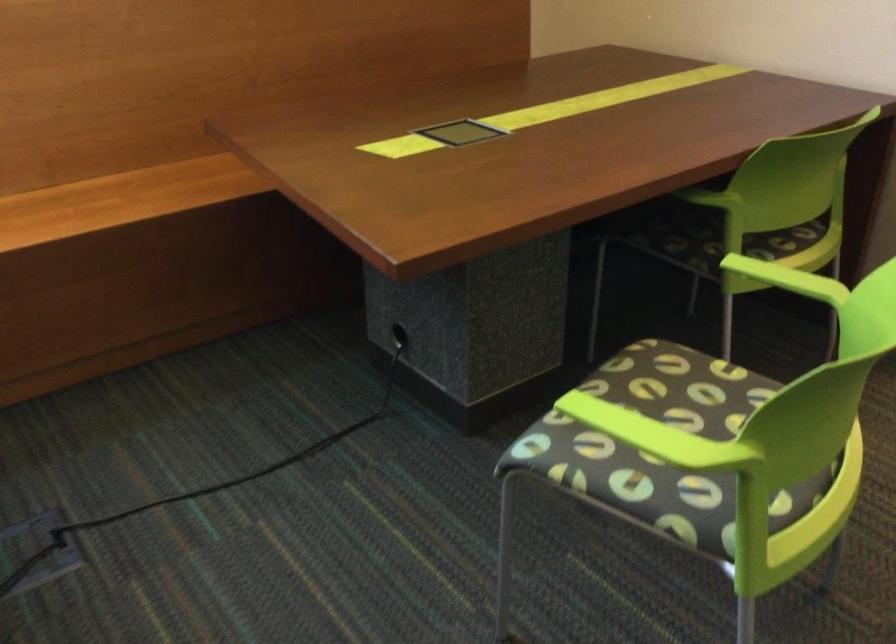
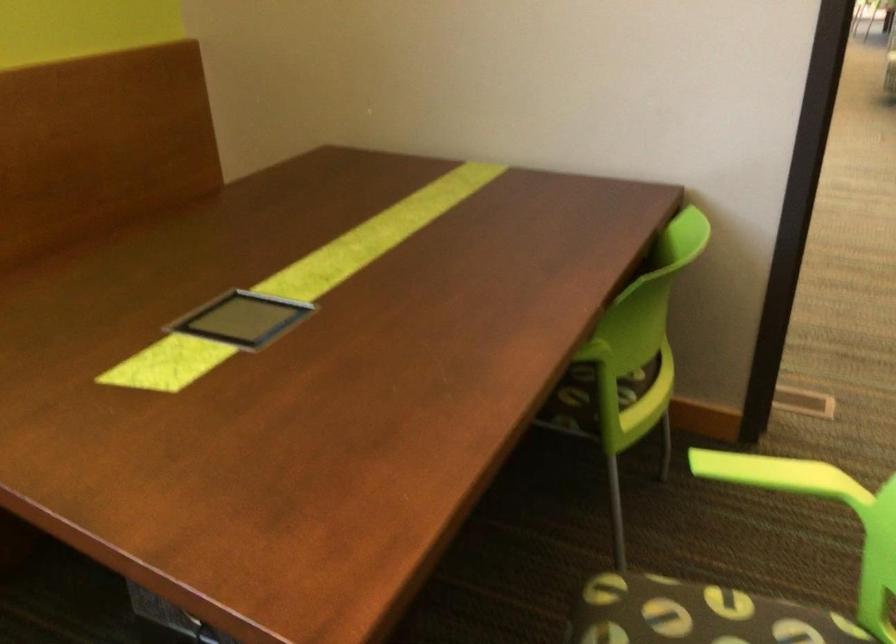
Question: The camera is either moving clockwise (left) or counter-clockwise (right) around the object. The first image is from the beginning of the video and the second image is from the end. Is the camera moving left or right when shooting the video?

Choices:
 (A) Left
 (B) Right

Answer: (A)